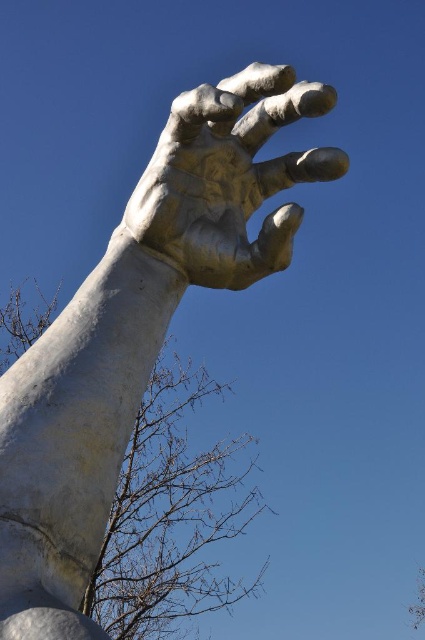
Can you confirm if white stone hand at upper center is positioned to the right of brown leafless branches at lower left?

Yes, white stone hand at upper center is to the right of brown leafless branches at lower left.

Can you confirm if white stone hand at upper center is bigger than brown leafless branches at lower left?

No.

Does point (76, 360) lie in front of point (164, 620)?

Yes, it is.

This screenshot has width=425, height=640. What are the coordinates of `white stone hand at upper center` in the screenshot? It's located at (138, 330).

Can you confirm if brown leafless branches at lower left is taller than gold polished hand at center?

Correct, brown leafless branches at lower left is much taller as gold polished hand at center.

Which is above, brown leafless branches at lower left or gold polished hand at center?

gold polished hand at center is higher up.

Between point (178, 625) and point (142, 227), which one is positioned behind?

Positioned behind is point (178, 625).

The height and width of the screenshot is (640, 425). I want to click on brown leafless branches at lower left, so click(170, 515).

Is white stone hand at upper center thinner than gold polished hand at center?

In fact, white stone hand at upper center might be wider than gold polished hand at center.

Is white stone hand at upper center smaller than gold polished hand at center?

Actually, white stone hand at upper center might be larger than gold polished hand at center.

What are the coordinates of `white stone hand at upper center` in the screenshot? It's located at (138, 330).